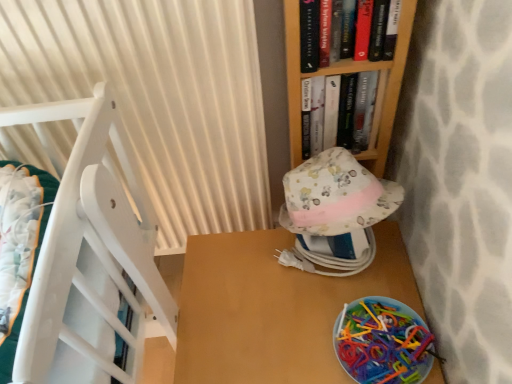
Question: Does point (344, 104) appear closer or farther from the camera than point (351, 167)?

Choices:
 (A) closer
 (B) farther

Answer: (B)

Question: Is hardcover book at upper center, which is the second book from front to back, taller or shorter than floral fabric hat at center?

Choices:
 (A) short
 (B) tall

Answer: (A)

Question: Considering the real-world distances, which object is farthest from the floral fabric hat at center?

Choices:
 (A) hardcover book at upper center, arranged as the 1th book when viewed from the back
 (B) translucent plastic toys at lower right
 (C) wooden table at lower right
 (D) white pleated curtain at left
 (E) hardcover book at upper center, the 2th book positioned from the back

Answer: (D)

Question: Which object is the farthest from the translucent plastic toys at lower right?

Choices:
 (A) wooden table at lower right
 (B) white pleated curtain at left
 (C) hardcover book at upper center, the 2th book positioned from the back
 (D) floral fabric hat at center
 (E) hardcover book at upper center, arranged as the 1th book when viewed from the back

Answer: (B)